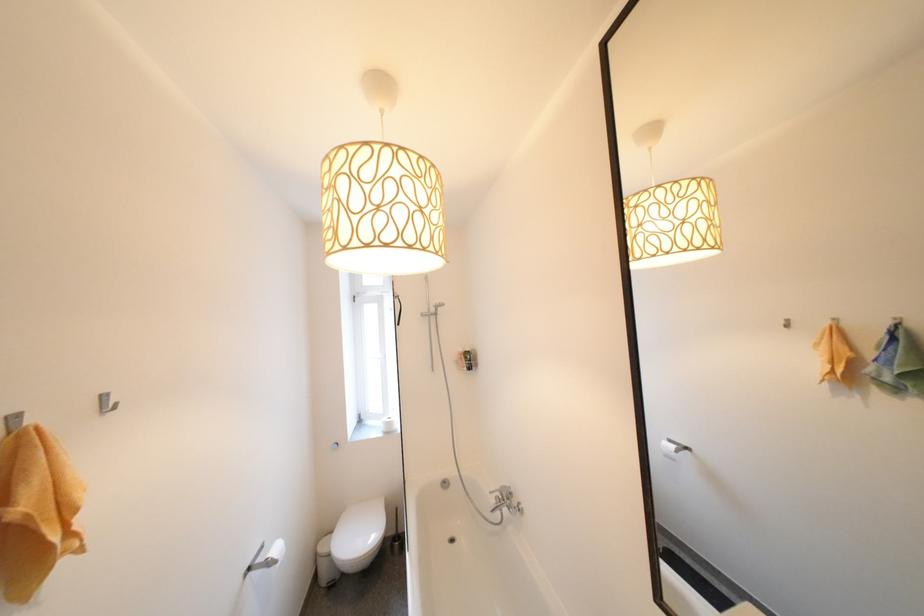
Describe the element at coordinates (105, 403) in the screenshot. I see `a silver flush button` at that location.